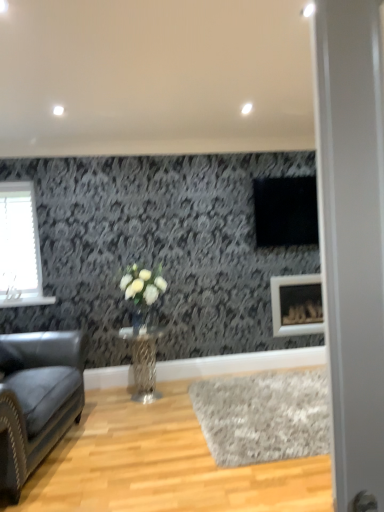
Question: From a real-world perspective, is transparent glass door at right physically located above or below metallic textured table at center?

Choices:
 (A) above
 (B) below

Answer: (A)

Question: In the image, is transparent glass door at right on the left side or the right side of metallic textured table at center?

Choices:
 (A) right
 (B) left

Answer: (A)

Question: Considering the real-world distances, which object is farthest from the metallic textured table at center?

Choices:
 (A) clear glass vase at center
 (B) gray shag rug at lower center
 (C) transparent glass door at right
 (D) leather couch at left
 (E) white matte vase at center

Answer: (C)

Question: Which of these objects is positioned farthest from the leather couch at left?

Choices:
 (A) gray shag rug at lower center
 (B) white matte picture frame at lower right
 (C) clear glass vase at center
 (D) white matte vase at center
 (E) metallic textured table at center

Answer: (B)